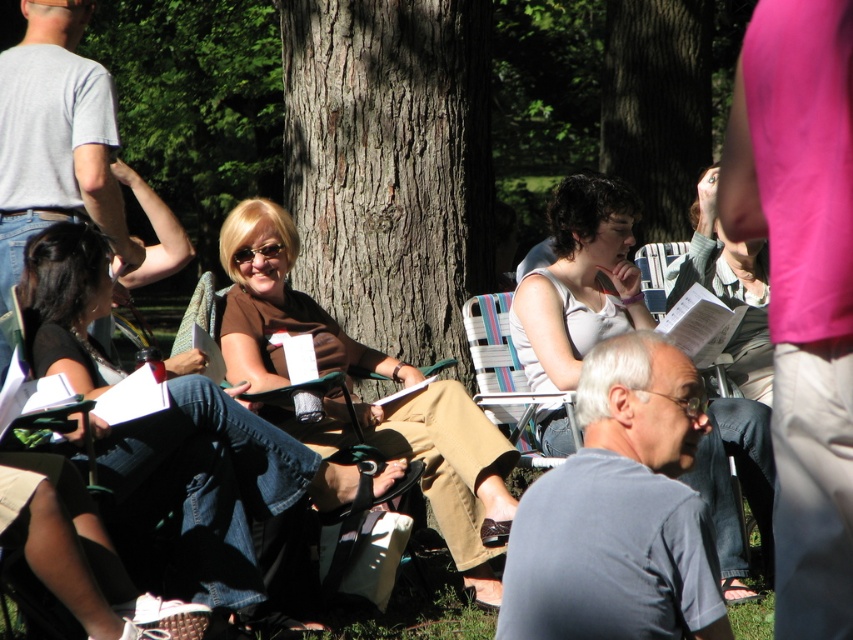
Question: Which is farther from the white matte tank top at center?

Choices:
 (A) matte brown shirt at center
 (B) brown matte shirt at center

Answer: (A)

Question: From the image, what is the correct spatial relationship of dark brown textured tree trunk at center in relation to white matte tank top at center?

Choices:
 (A) above
 (B) below

Answer: (A)

Question: From the image, what is the correct spatial relationship of dark brown textured tree trunk at center in relation to white matte tank top at center?

Choices:
 (A) right
 (B) left

Answer: (B)

Question: Which point appears farthest from the camera in this image?

Choices:
 (A) (677, 115)
 (B) (453, 532)
 (C) (599, 260)
 (D) (451, 81)

Answer: (A)

Question: Is brown matte shirt at center to the right of smooth bark tree at center from the viewer's perspective?

Choices:
 (A) yes
 (B) no

Answer: (B)

Question: Which object is closer to the camera taking this photo?

Choices:
 (A) white matte tank top at center
 (B) matte brown shirt at center

Answer: (B)